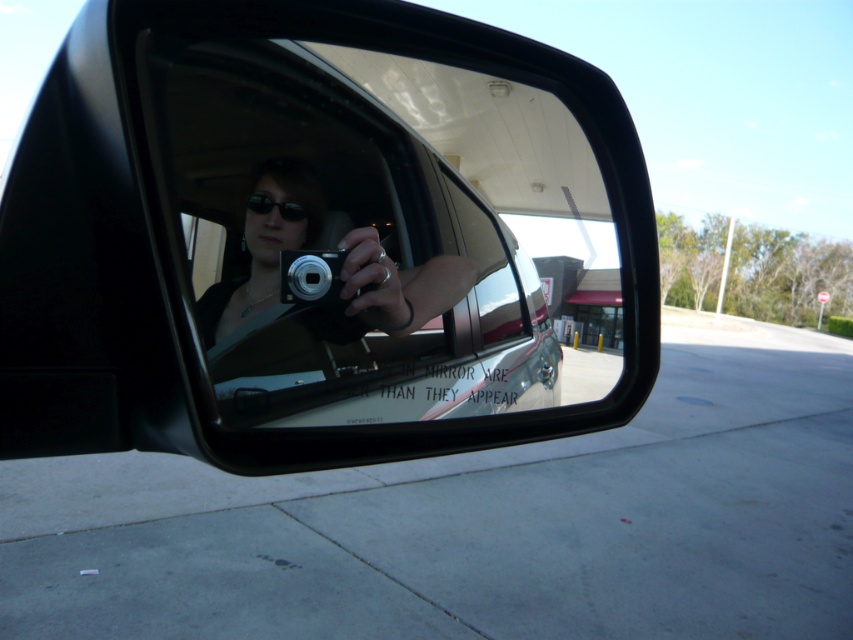
Is transparent glass car window at center above matte black camera at center?

Incorrect, transparent glass car window at center is not positioned above matte black camera at center.

Based on the photo, can you confirm if transparent glass car window at center is thinner than matte black camera at center?

Incorrect, transparent glass car window at center's width is not less than matte black camera at center's.

Between point (305, 355) and point (445, 284), which one is positioned behind?

The point (445, 284) is more distant.

You are a GUI agent. You are given a task and a screenshot of the screen. Output one action in this format:
    pyautogui.click(x=<x>, y=<y>)
    Task: Click on the transparent glass car window at center
    
    Given the screenshot: What is the action you would take?
    pyautogui.click(x=346, y=256)

Can you confirm if transparent glass car window at center is positioned to the right of silver metallic camera at center?

Yes, transparent glass car window at center is to the right of silver metallic camera at center.

Between transparent glass car window at center and silver metallic camera at center, which one appears on the left side from the viewer's perspective?

From the viewer's perspective, silver metallic camera at center appears more on the left side.

This screenshot has width=853, height=640. What do you see at coordinates (346, 256) in the screenshot?
I see `transparent glass car window at center` at bounding box center [346, 256].

Find the location of a particular element. The width and height of the screenshot is (853, 640). transparent glass car window at center is located at coordinates (346, 256).

Does matte black camera at center appear under silver metallic camera at center?

No.

Describe the element at coordinates (263, 246) in the screenshot. I see `matte black camera at center` at that location.

Identify the location of matte black camera at center. The height and width of the screenshot is (640, 853). (263, 246).